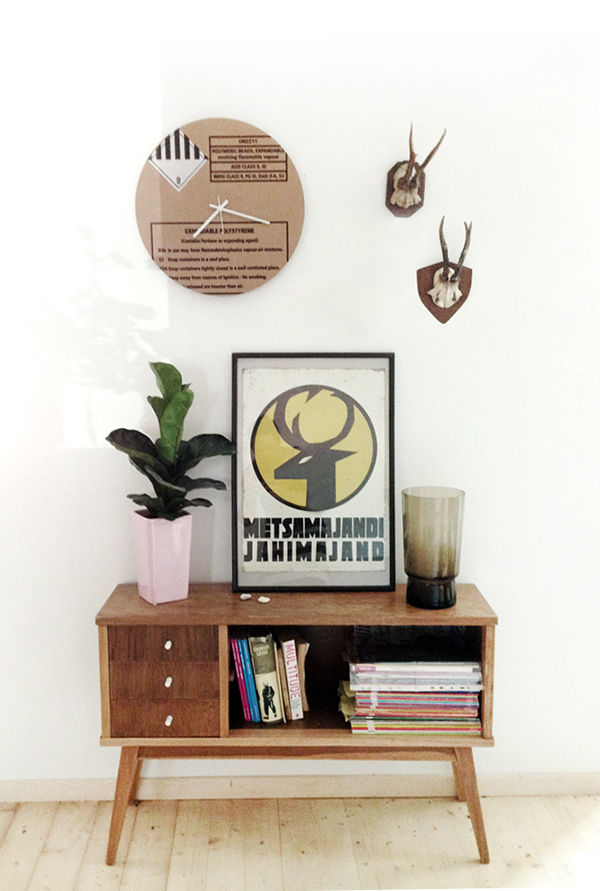
Image resolution: width=600 pixels, height=891 pixels. I want to click on cabinets, so (x=185, y=643), (x=185, y=683), (x=188, y=713).